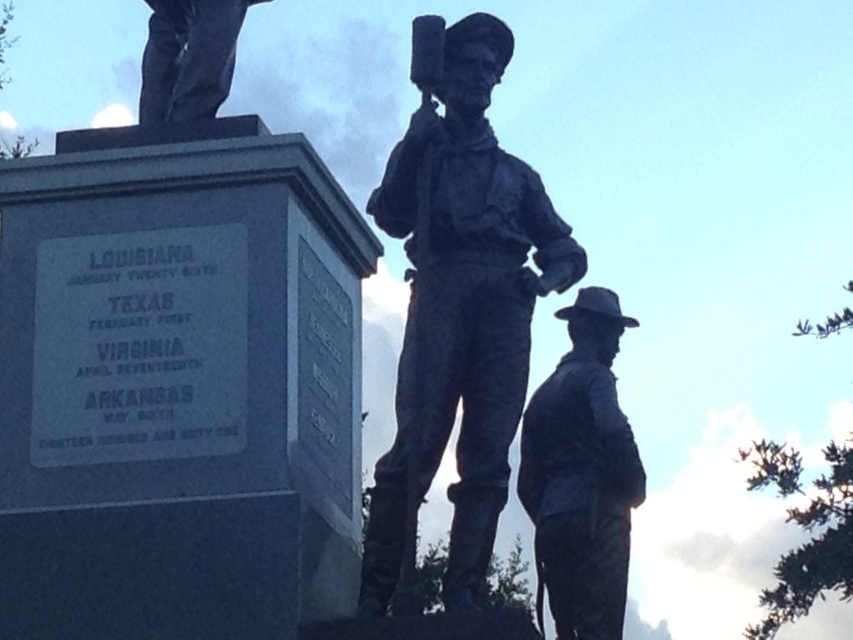
Question: Is bronze statue at lower right to the left of polished bronze statue at upper left from the viewer's perspective?

Choices:
 (A) yes
 (B) no

Answer: (B)

Question: Estimate the real-world distances between objects in this image. Which object is closer to the polished bronze statue at upper left?

Choices:
 (A) bronze statue at lower right
 (B) bronze statue at center

Answer: (B)

Question: Which of the following is the closest to the observer?

Choices:
 (A) bronze statue at center
 (B) polished bronze statue at upper left

Answer: (A)

Question: Considering the relative positions of bronze statue at center and bronze statue at lower right in the image provided, where is bronze statue at center located with respect to bronze statue at lower right?

Choices:
 (A) left
 (B) right

Answer: (A)

Question: Observing the image, what is the correct spatial positioning of bronze statue at center in reference to polished bronze statue at upper left?

Choices:
 (A) above
 (B) below

Answer: (B)

Question: Which object is positioned closest to the polished bronze statue at upper left?

Choices:
 (A) bronze statue at lower right
 (B) bronze statue at center

Answer: (B)